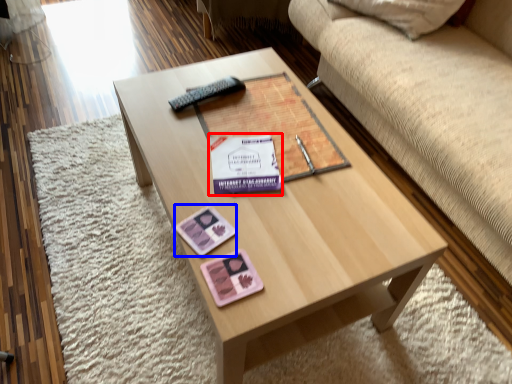
Question: Which object appears farthest to the camera in this image, paperback book (highlighted by a red box) or currency (highlighted by a blue box)?

Choices:
 (A) paperback book
 (B) currency

Answer: (A)